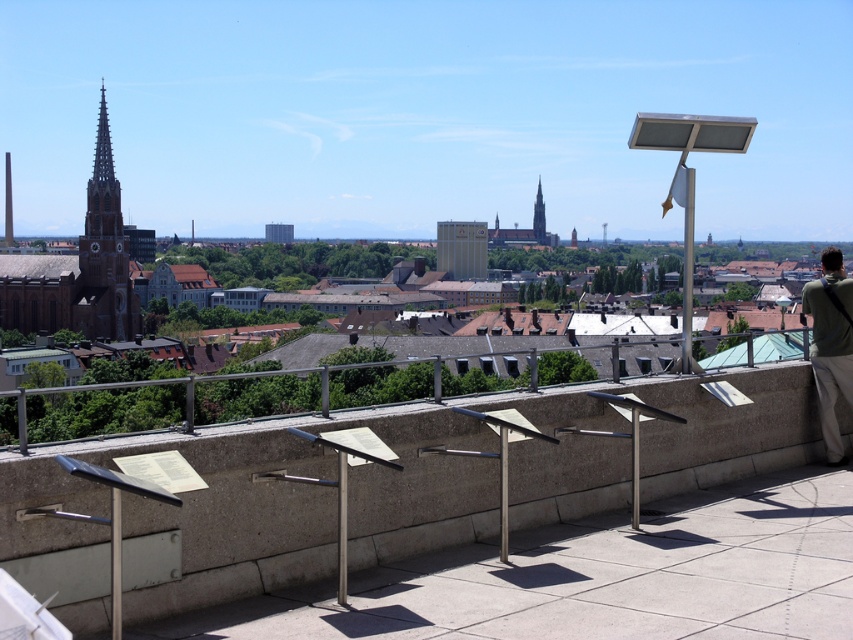
Can you confirm if concrete at center is smaller than matte gold spire at left?

Indeed, concrete at center has a smaller size compared to matte gold spire at left.

Is concrete at center positioned at the back of matte gold spire at left?

That is False.

Who is more distant from viewer, (323, 452) or (109, 172)?

The point (109, 172) is more distant.

This screenshot has height=640, width=853. Find the location of `concrete at center`. concrete at center is located at coordinates (173, 525).

Is point (685, 269) closer to camera compared to point (534, 204)?

Yes, point (685, 269) is in front of point (534, 204).

Is metallic pole at upper center to the left of smooth glass spire at center from the viewer's perspective?

In fact, metallic pole at upper center is to the right of smooth glass spire at center.

Find the location of `metallic pole at upper center`. metallic pole at upper center is located at coordinates (686, 257).

Who is lower down, matte gold spire at left or smooth glass spire at center?

Positioned lower is matte gold spire at left.

The width and height of the screenshot is (853, 640). What do you see at coordinates (103, 252) in the screenshot?
I see `matte gold spire at left` at bounding box center [103, 252].

Which is in front, point (115, 333) or point (543, 218)?

Point (115, 333)

The width and height of the screenshot is (853, 640). I want to click on matte gold spire at left, so click(x=103, y=252).